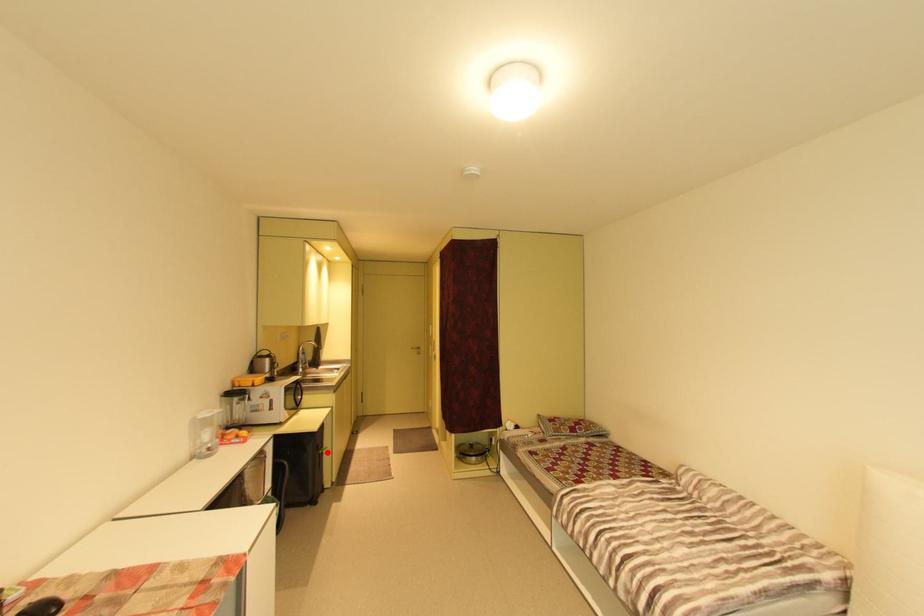
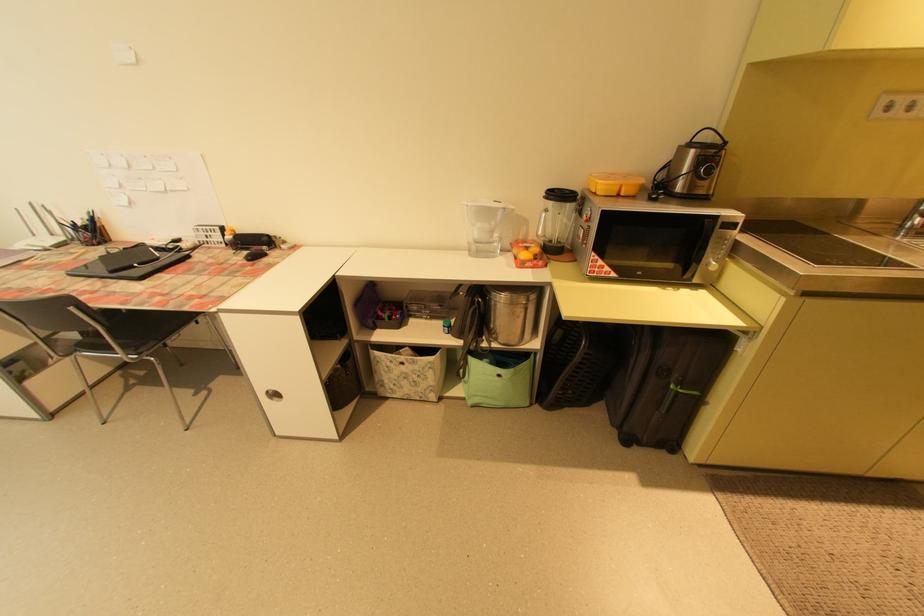
Question: I am providing you with two images of the same scene from different viewpoints. In image1, a red point is highlighted. Considering the same 3D point in image2, which of the following is correct?

Choices:
 (A) It is closer
 (B) It is farther

Answer: (B)